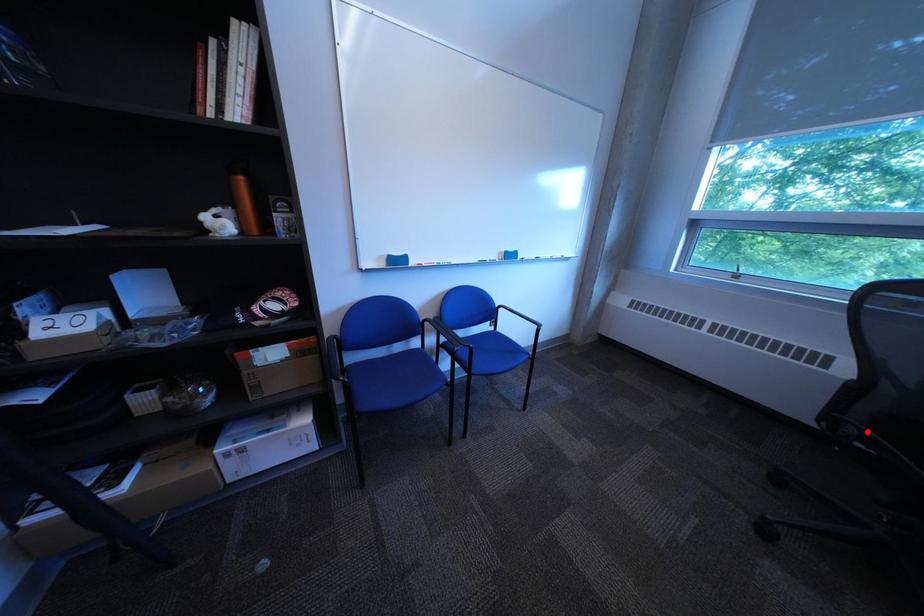
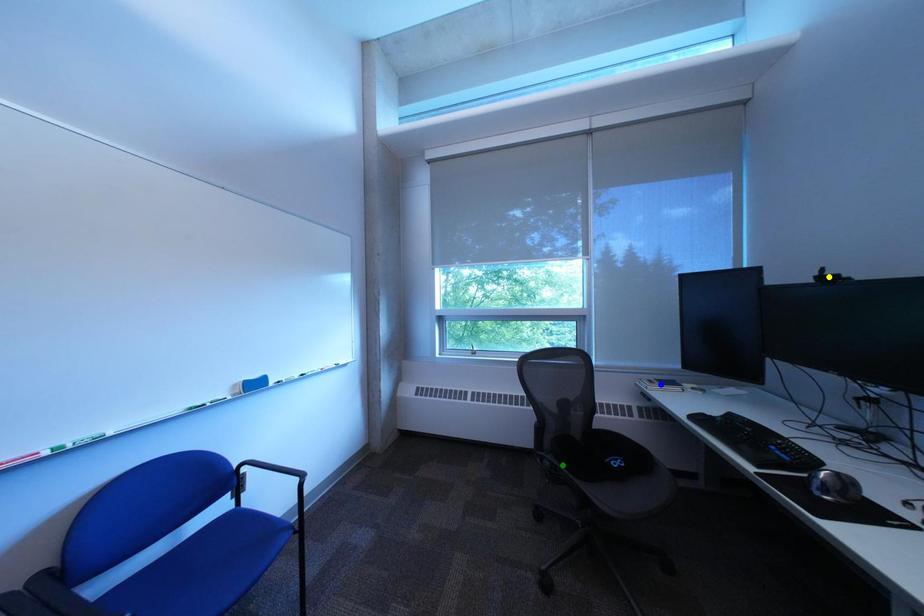
Question: I am providing you with two images of the same scene from different viewpoints. A red point is marked on the first image. You are given multiple points on the second image. Which mark in image 2 goes with the point in image 1?

Choices:
 (A) blue point
 (B) yellow point
 (C) green point

Answer: (C)